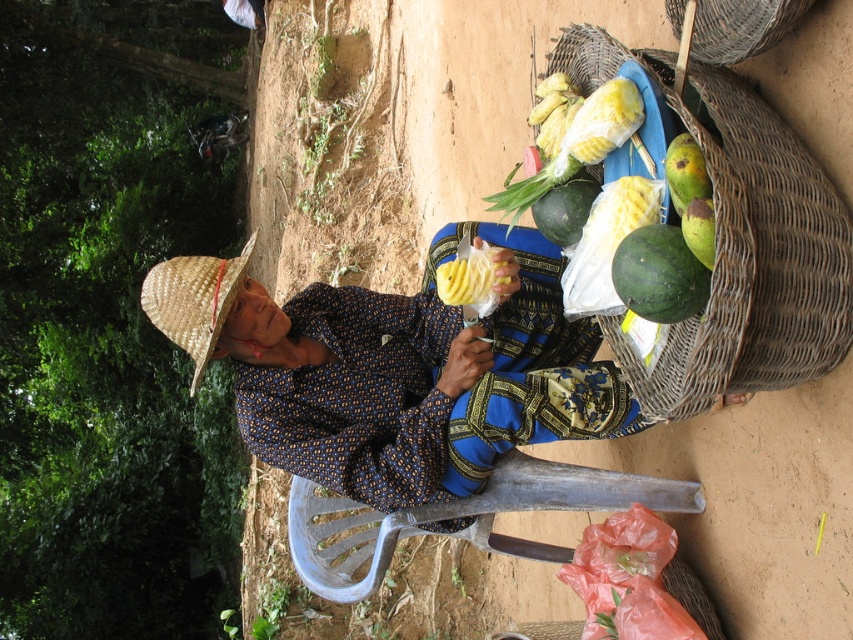
Which is more to the left, brown straw hat at upper left or green matte mango at right?

brown straw hat at upper left

The height and width of the screenshot is (640, 853). In order to click on brown straw hat at upper left in this screenshot , I will do `click(396, 371)`.

Which is in front, point (671, 280) or point (708, 221)?

Point (708, 221)

This screenshot has width=853, height=640. Describe the element at coordinates (659, 275) in the screenshot. I see `green matte watermelon at right` at that location.

At what (x,y) coordinates should I click in order to perform the action: click on green matte watermelon at right. Please return your answer as a coordinate pair (x, y). The width and height of the screenshot is (853, 640). Looking at the image, I should click on 659,275.

Who is lower down, straw hat at left or green matte watermelon at right?

straw hat at left

Which of these two, straw hat at left or green matte watermelon at right, stands shorter?

Standing shorter between the two is green matte watermelon at right.

Where is `straw hat at left`? straw hat at left is located at coordinates (194, 300).